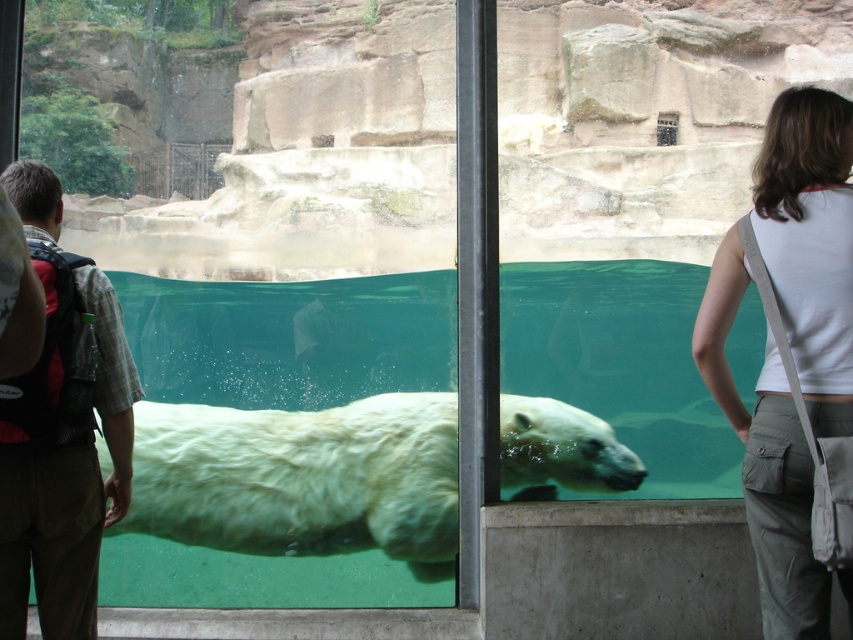
You are a zookeeper who needs to ensure that the white fluffy polar bear at center can comfortably swim in its tank. Considering the height difference between the polar bear and the white cotton tank top at right, what should you check first?

The white fluffy polar bear at center has a lesser height compared to the white cotton tank top at right. Therefore, the zookeeper should first check if the tank top is positioned in a way that might obstruct the polar bear from moving freely in the tank.

You are standing at the point marked as point (302,480) in the zoo exhibit. What animal are you observing?

The point (302,480) corresponds to the white fluffy polar bear at center, so you are observing the white fluffy polar bear at center.